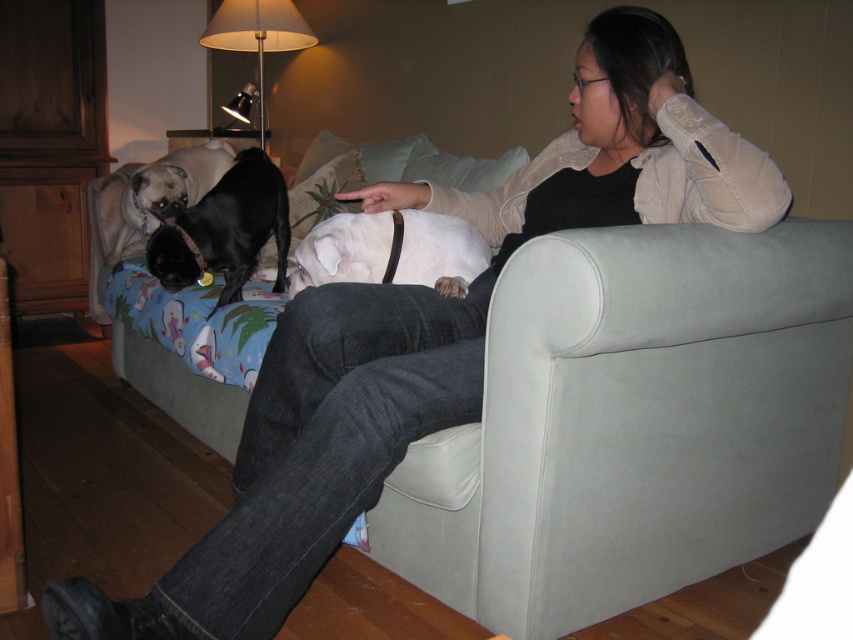
Describe the element at coordinates (631, 422) in the screenshot. I see `light gray fabric couch at center` at that location.

Does light gray fabric couch at center have a greater width compared to matte black dog at upper left?

Yes.

Find the location of `light gray fabric couch at center`. light gray fabric couch at center is located at coordinates (631, 422).

Which is below, white matte dog at center or matte black dog at upper left?

white matte dog at center

Does white matte dog at center appear on the left side of matte black dog at upper left?

Incorrect, white matte dog at center is not on the left side of matte black dog at upper left.

Does point (335, 262) lie behind point (189, 189)?

No, it is in front of (189, 189).

I want to click on white matte dog at center, so click(390, 252).

Between light gray fabric couch at center and black smooth dog at center, which one appears on the left side from the viewer's perspective?

black smooth dog at center

Does point (561, 248) come in front of point (177, 269)?

Yes, it is.

Locate an element on the screen. light gray fabric couch at center is located at coordinates (631, 422).